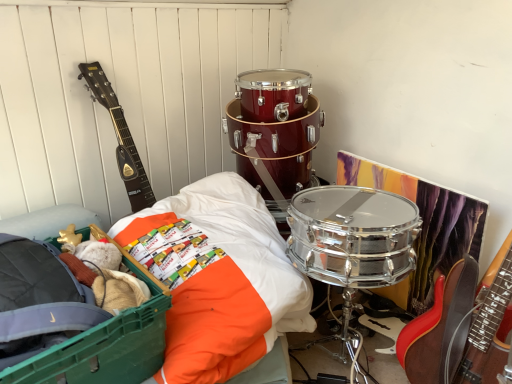
Question: Is green plastic storage box at lower left smaller than orange fabric bedsheet at center-left?

Choices:
 (A) no
 (B) yes

Answer: (B)

Question: Could you tell me if green plastic storage box at lower left is turned towards orange fabric bedsheet at center-left?

Choices:
 (A) yes
 (B) no

Answer: (B)

Question: Is green plastic storage box at lower left positioned far away from orange fabric bedsheet at center-left?

Choices:
 (A) yes
 (B) no

Answer: (B)

Question: Can you see green plastic storage box at lower left touching orange fabric bedsheet at center-left?

Choices:
 (A) yes
 (B) no

Answer: (B)

Question: From the image's perspective, is green plastic storage box at lower left under orange fabric bedsheet at center-left?

Choices:
 (A) yes
 (B) no

Answer: (A)

Question: Is green plastic storage box at lower left thinner than orange fabric bedsheet at center-left?

Choices:
 (A) yes
 (B) no

Answer: (A)

Question: Considering the relative sizes of dark wood acoustic guitar at left and orange fabric bedsheet at center-left in the image provided, is dark wood acoustic guitar at left thinner than orange fabric bedsheet at center-left?

Choices:
 (A) no
 (B) yes

Answer: (B)

Question: Does dark wood acoustic guitar at left have a smaller size compared to orange fabric bedsheet at center-left?

Choices:
 (A) yes
 (B) no

Answer: (A)

Question: Considering the relative positions of dark wood acoustic guitar at left and orange fabric bedsheet at center-left in the image provided, is dark wood acoustic guitar at left to the right of orange fabric bedsheet at center-left from the viewer's perspective?

Choices:
 (A) yes
 (B) no

Answer: (B)

Question: Can you confirm if dark wood acoustic guitar at left is shorter than orange fabric bedsheet at center-left?

Choices:
 (A) no
 (B) yes

Answer: (A)

Question: Could you tell me if dark wood acoustic guitar at left is turned towards orange fabric bedsheet at center-left?

Choices:
 (A) no
 (B) yes

Answer: (B)

Question: Does dark wood acoustic guitar at left have a larger size compared to orange fabric bedsheet at center-left?

Choices:
 (A) yes
 (B) no

Answer: (B)

Question: Is orange fabric bedsheet at center-left shorter than green plastic storage box at lower left?

Choices:
 (A) yes
 (B) no

Answer: (B)